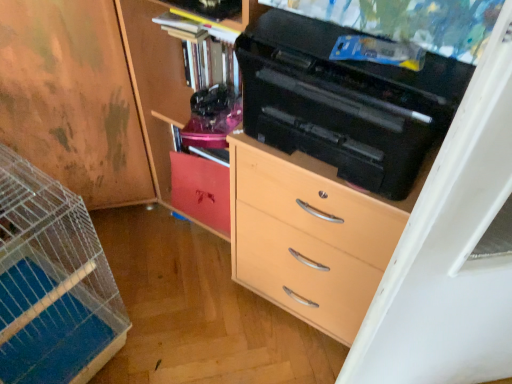
Question: From a real-world perspective, is matte wood cabinet at center, the 1th cabinetry positioned from the right, positioned over wooden cabinet at left, which appears as the 1th cabinetry when viewed from the left, based on gravity?

Choices:
 (A) yes
 (B) no

Answer: (A)

Question: Is matte wood cabinet at center, the 3th cabinetry when ordered from left to right, thinner than wooden cabinet at left, the 3th cabinetry from the right?

Choices:
 (A) yes
 (B) no

Answer: (A)

Question: Would you say wooden cabinet at left, which appears as the 1th cabinetry when viewed from the left, is part of matte wood cabinet at center, the 1th cabinetry positioned from the right,'s contents?

Choices:
 (A) yes
 (B) no

Answer: (B)

Question: Is matte wood cabinet at center, the 3th cabinetry when ordered from left to right, bigger than wooden cabinet at left, the 3th cabinetry from the right?

Choices:
 (A) no
 (B) yes

Answer: (A)

Question: Does matte wood cabinet at center, the 1th cabinetry positioned from the right, appear on the right side of wooden cabinet at left, which appears as the 1th cabinetry when viewed from the left?

Choices:
 (A) yes
 (B) no

Answer: (A)

Question: Is matte wood cabinet at center, the 1th cabinetry positioned from the right, facing away from wooden cabinet at left, which appears as the 1th cabinetry when viewed from the left?

Choices:
 (A) yes
 (B) no

Answer: (B)

Question: Is matte wood chest of drawers at center at the left side of matte wood cabinet at center, arranged as the second cabinetry when viewed from the right?

Choices:
 (A) no
 (B) yes

Answer: (A)

Question: Is matte wood chest of drawers at center wider than matte wood cabinet at center, arranged as the second cabinetry when viewed from the right?

Choices:
 (A) yes
 (B) no

Answer: (A)

Question: Does matte wood chest of drawers at center have a larger size compared to matte wood cabinet at center, arranged as the second cabinetry when viewed from the right?

Choices:
 (A) yes
 (B) no

Answer: (A)

Question: Is matte wood chest of drawers at center completely or partially outside of matte wood cabinet at center, placed as the 2th cabinetry when sorted from left to right?

Choices:
 (A) yes
 (B) no

Answer: (A)

Question: Does matte wood chest of drawers at center have a greater height compared to matte wood cabinet at center, placed as the 2th cabinetry when sorted from left to right?

Choices:
 (A) no
 (B) yes

Answer: (B)

Question: From a real-world perspective, does matte wood chest of drawers at center sit lower than matte wood cabinet at center, placed as the 2th cabinetry when sorted from left to right?

Choices:
 (A) yes
 (B) no

Answer: (B)

Question: Is matte wood cabinet at center, the 3th cabinetry when ordered from left to right, directly adjacent to matte wood chest of drawers at center?

Choices:
 (A) yes
 (B) no

Answer: (B)